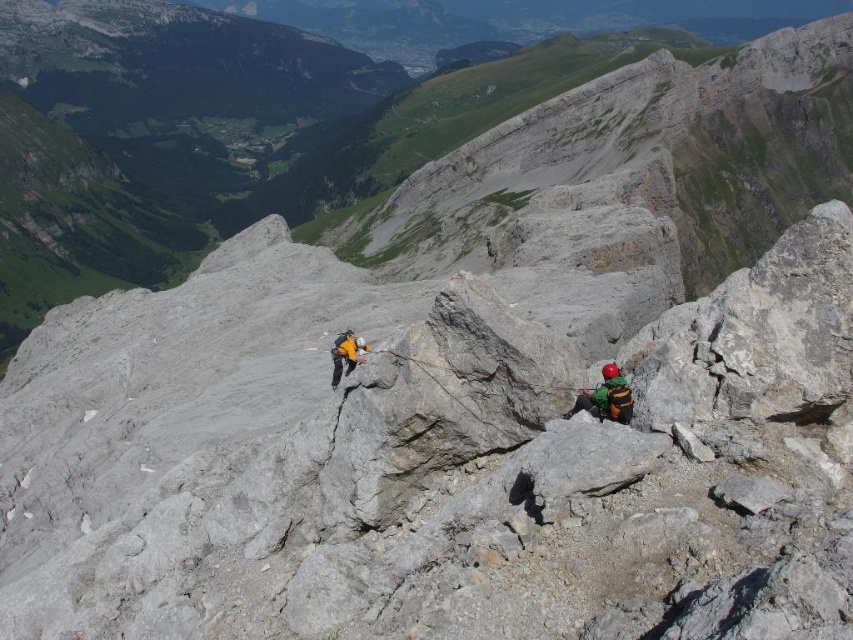
Question: Based on their relative distances, which object is farther from the green fabric harness at center?

Choices:
 (A) ropetexturedrope at center
 (B) yellow fabric helmet at center

Answer: (B)

Question: Observing the image, what is the correct spatial positioning of ropetexturedrope at center in reference to yellow fabric helmet at center?

Choices:
 (A) below
 (B) above

Answer: (A)

Question: Which point is closer to the camera?

Choices:
 (A) (610, 396)
 (B) (456, 369)

Answer: (A)

Question: Which point is closer to the camera?

Choices:
 (A) (352, 332)
 (B) (521, 380)

Answer: (B)

Question: Is green fabric harness at center bigger than yellow fabric helmet at center?

Choices:
 (A) yes
 (B) no

Answer: (B)

Question: Is green fabric harness at center wider than yellow fabric helmet at center?

Choices:
 (A) no
 (B) yes

Answer: (A)